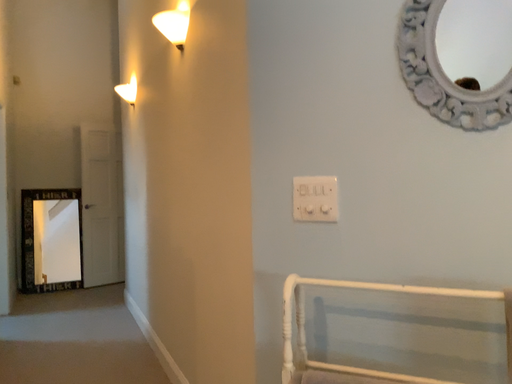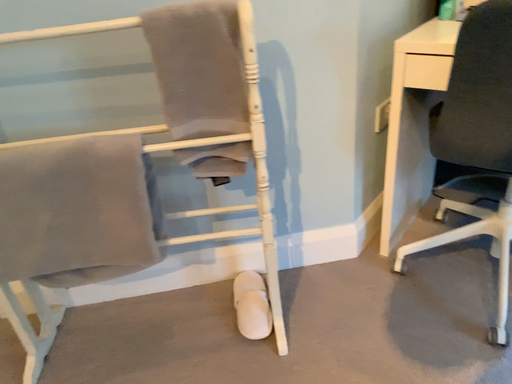
Question: Which way did the camera rotate in the video?

Choices:
 (A) rotated right
 (B) rotated left

Answer: (A)